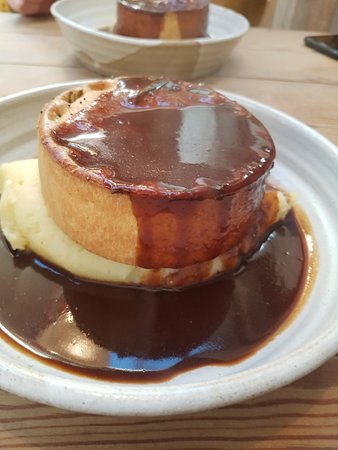
Find the location of a particular element. This screenshot has width=338, height=450. wooden table is located at coordinates (91, 47), (309, 85).